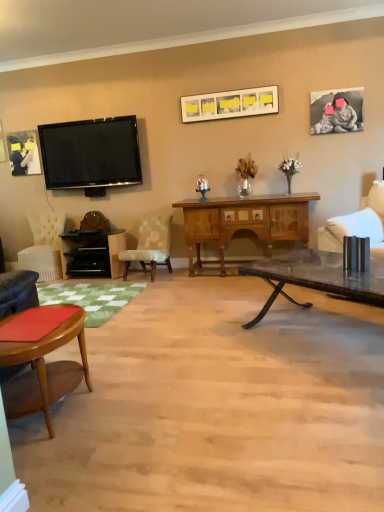
This screenshot has height=512, width=384. Describe the element at coordinates (92, 253) in the screenshot. I see `black glossy cabinet at lower left` at that location.

The width and height of the screenshot is (384, 512). What do you see at coordinates (23, 153) in the screenshot? I see `matte black picture frame at upper left, which is the 3th picture frame from right to left` at bounding box center [23, 153].

This screenshot has width=384, height=512. What do you see at coordinates (244, 222) in the screenshot? I see `wooden cabinet at center` at bounding box center [244, 222].

Describe the element at coordinates (91, 153) in the screenshot. I see `flat screen tv at upper left` at that location.

What is the approximate width of flat screen tv at upper left?

The width of flat screen tv at upper left is 6.03 inches.

Identify the location of black glossy cabinet at lower left. (92, 253).

From a real-world perspective, who is located lower, wooden cabinet at center or velvet white chair at left, marked as the first chair in a left-to-right arrangement?

In real-world perspective, velvet white chair at left, marked as the first chair in a left-to-right arrangement, is lower.

Between wooden cabinet at center and velvet white chair at left, marked as the first chair in a left-to-right arrangement, which one has larger width?

With larger width is velvet white chair at left, marked as the first chair in a left-to-right arrangement.

Is wooden cabinet at center oriented towards velvet white chair at left, the 1th chair from the back?

No, wooden cabinet at center is not turned towards velvet white chair at left, the 1th chair from the back.

Does point (36, 161) come behind point (242, 95)?

That is True.

From the image's perspective, which object appears higher, matte black picture frame at upper left, placed as the third picture frame when sorted from front to back, or matte white picture frame at upper center, arranged as the 2th picture frame when viewed from the left?

matte white picture frame at upper center, arranged as the 2th picture frame when viewed from the left, is shown above in the image.

Based on the photo, between matte black picture frame at upper left, the 1th picture frame in the left-to-right sequence, and matte white picture frame at upper center, the second picture frame when ordered from right to left, which one appears on the left side from the viewer's perspective?

Positioned to the left is matte black picture frame at upper left, the 1th picture frame in the left-to-right sequence.

Relative to matte white picture frame at upper center, arranged as the 2th picture frame when viewed from the left, is matte black picture frame at upper left, the 1th picture frame in the left-to-right sequence, in front or behind?

matte black picture frame at upper left, the 1th picture frame in the left-to-right sequence, is positioned farther from the viewer than matte white picture frame at upper center, arranged as the 2th picture frame when viewed from the left.

Which of these two, wooden cabinet at center or wooden oval chair at lower left, the 1th chair positioned from the front, stands shorter?

With less height is wooden oval chair at lower left, the 1th chair positioned from the front.

Considering the relative sizes of wooden cabinet at center and wooden oval chair at lower left, which is the fourth chair from back to front, in the image provided, is wooden cabinet at center wider than wooden oval chair at lower left, which is the fourth chair from back to front,?

Yes.

Is wooden cabinet at center oriented away from wooden oval chair at lower left, arranged as the third chair when viewed from the right?

wooden cabinet at center is not turned away from wooden oval chair at lower left, arranged as the third chair when viewed from the right.

From the picture: Can you confirm if wooden cabinet at center is positioned to the right of wooden oval chair at lower left, arranged as the third chair when viewed from the right?

Yes.

Who is shorter, velvet white chair at left, the fourth chair positioned from the front, or patterned fabric chair at center, the 3th chair from the front?

With less height is patterned fabric chair at center, the 3th chair from the front.

Looking at this image, from a real-world perspective, who is located lower, velvet white chair at left, marked as the first chair in a left-to-right arrangement, or patterned fabric chair at center, placed as the second chair when sorted from right to left?

In real-world perspective, patterned fabric chair at center, placed as the second chair when sorted from right to left, is lower.

From a real-world perspective, count 1st chairs upward from the patterned fabric chair at center, the second chair positioned from the back, and point to it. Please provide its 2D coordinates.

[(44, 246)]

Which is correct: black matte photo frame at upper right, placed as the 3th picture frame when sorted from back to front, is inside wooden cabinet at center, or outside of it?

black matte photo frame at upper right, placed as the 3th picture frame when sorted from back to front, is not inside wooden cabinet at center, it's outside.

Considering their positions, is black matte photo frame at upper right, acting as the first picture frame starting from the right, located in front of or behind wooden cabinet at center?

Visually, black matte photo frame at upper right, acting as the first picture frame starting from the right, is located behind wooden cabinet at center.

Are black matte photo frame at upper right, which is the 1th picture frame from front to back, and wooden cabinet at center beside each other?

No, black matte photo frame at upper right, which is the 1th picture frame from front to back, is not beside wooden cabinet at center.

Is black glossy cabinet at lower left aimed at matte black picture frame at upper left, which is the 3th picture frame from right to left?

No, black glossy cabinet at lower left is not facing towards matte black picture frame at upper left, which is the 3th picture frame from right to left.

Does point (85, 266) appear closer or farther from the camera than point (17, 133)?

Point (85, 266).

Identify the location of cabinetry lying in front of the matte black picture frame at upper left, which ranks as the 1th picture frame in back-to-front order. The image size is (384, 512). (92, 253).

Is black matte photo frame at upper right, placed as the 3th picture frame when sorted from back to front, not inside velvet white chair at left, the fourth chair positioned from the front?

black matte photo frame at upper right, placed as the 3th picture frame when sorted from back to front, is positioned outside velvet white chair at left, the fourth chair positioned from the front.

Based on their positions, is black matte photo frame at upper right, placed as the 3th picture frame when sorted from back to front, located to the left or right of velvet white chair at left, marked as the first chair in a left-to-right arrangement?

In the image, black matte photo frame at upper right, placed as the 3th picture frame when sorted from back to front, appears on the right side of velvet white chair at left, marked as the first chair in a left-to-right arrangement.

Is black matte photo frame at upper right, placed as the 3th picture frame when sorted from back to front, positioned in front of velvet white chair at left, the 1th chair from the back?

Yes, it is in front of velvet white chair at left, the 1th chair from the back.

Based on the photo, from the image's perspective, which one is positioned lower, black matte photo frame at upper right, placed as the 3th picture frame when sorted from back to front, or velvet white chair at left, marked as the first chair in a left-to-right arrangement?

velvet white chair at left, marked as the first chair in a left-to-right arrangement, is shown below in the image.

There is a wooden cabinet at center. Identify the location of the 1st chair below it (from the image's perspective). The width and height of the screenshot is (384, 512). (44, 246).

Find the location of `the 2nd picture frame located beneath the matte white picture frame at upper center, arranged as the 2th picture frame when viewed from the left (from a real-world perspective)`. the 2nd picture frame located beneath the matte white picture frame at upper center, arranged as the 2th picture frame when viewed from the left (from a real-world perspective) is located at coordinates (23, 153).

Which object lies nearer to the anchor point black matte photo frame at upper right, acting as the first picture frame starting from the right, black glossy cabinet at lower left or flat screen tv at upper left?

flat screen tv at upper left.

Estimate the real-world distances between objects in this image. Which object is closer to velvet white chair at left, the fourth chair positioned from the front, wooden oval chair at lower left, which is the fourth chair from back to front, or matte black picture frame at upper left, which is the 3th picture frame from right to left?

matte black picture frame at upper left, which is the 3th picture frame from right to left.

Based on their spatial positions, is patterned fabric chair at center, the second chair positioned from the back, or black glossy cabinet at lower left further from black matte photo frame at upper right, which is the 1th picture frame from front to back?

The object further to black matte photo frame at upper right, which is the 1th picture frame from front to back, is black glossy cabinet at lower left.

Looking at this image, considering their positions, is wooden oval chair at lower left, acting as the 2th chair starting from the left, positioned closer to flat screen tv at upper left than matte white picture frame at upper center, which appears as the 2th picture frame when viewed from the back?

The object closer to flat screen tv at upper left is matte white picture frame at upper center, which appears as the 2th picture frame when viewed from the back.

Looking at the image, which one is located further to patterned fabric chair at center, the 3th chair from the front, black glossy cabinet at lower left or matte white picture frame at upper center, which is the second picture frame from front to back?

The object further to patterned fabric chair at center, the 3th chair from the front, is matte white picture frame at upper center, which is the second picture frame from front to back.

Which object lies nearer to the anchor point wooden cabinet at center, wooden oval chair at lower left, acting as the 2th chair starting from the left, or flat screen tv at upper left?

flat screen tv at upper left.

Which object lies nearer to the anchor point transparent glass coffee table at center, flat screen tv at upper left or matte white picture frame at upper center, arranged as the 2th picture frame when viewed from the left?

matte white picture frame at upper center, arranged as the 2th picture frame when viewed from the left, is closer to transparent glass coffee table at center.

Considering their positions, is white fabric chair at right, the first chair positioned from the right, positioned further to flat screen tv at upper left than transparent glass coffee table at center?

transparent glass coffee table at center is positioned further to the anchor flat screen tv at upper left.

What are the coordinates of `cabinetry between matte black picture frame at upper left, which is the 3th picture frame from right to left, and white fabric chair at right, the first chair positioned from the right, from left to right` in the screenshot? It's located at (92, 253).

Where is `coffee table between wooden oval chair at lower left, arranged as the third chair when viewed from the right, and white fabric chair at right, the first chair positioned from the right`? coffee table between wooden oval chair at lower left, arranged as the third chair when viewed from the right, and white fabric chair at right, the first chair positioned from the right is located at coordinates (317, 277).

Where is `desk between patterned fabric chair at center, the 3th chair from the front, and white fabric chair at right, the third chair when ordered from back to front, from left to right`? desk between patterned fabric chair at center, the 3th chair from the front, and white fabric chair at right, the third chair when ordered from back to front, from left to right is located at coordinates (244, 222).

At what (x,y) coordinates should I click in order to perform the action: click on television between matte black picture frame at upper left, which ranks as the 1th picture frame in back-to-front order, and matte white picture frame at upper center, which is the second picture frame from front to back. Please return your answer as a coordinate pair (x, y). Image resolution: width=384 pixels, height=512 pixels. Looking at the image, I should click on (91, 153).